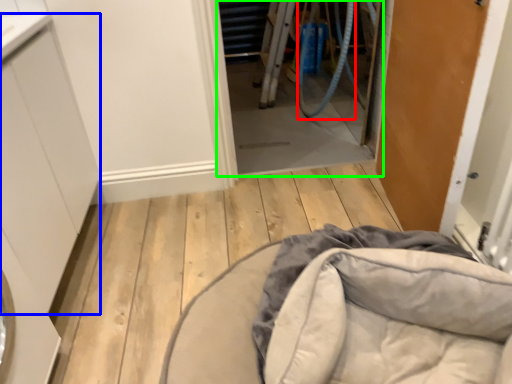
Question: Considering the real-world distances, which object is closest to garden hose (highlighted by a red box)? cabinetry (highlighted by a blue box) or screen door (highlighted by a green box).

Choices:
 (A) cabinetry
 (B) screen door

Answer: (B)